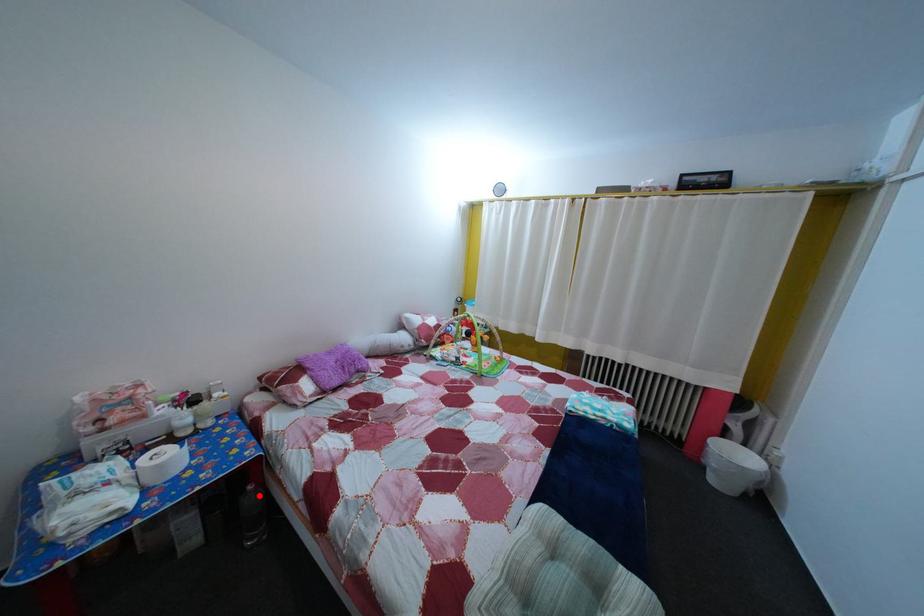
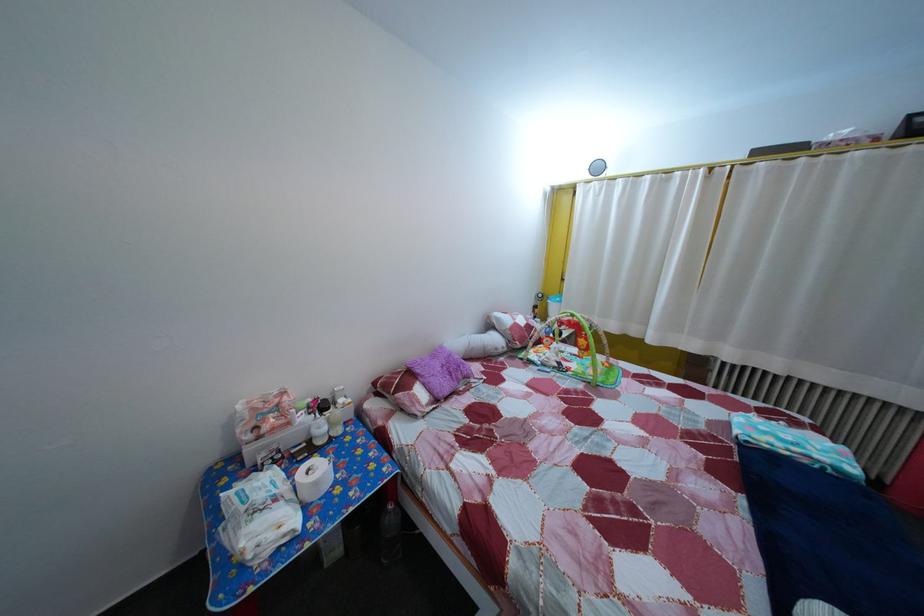
Find the pixel in the second image that matches the highlighted location in the first image.

(399, 515)